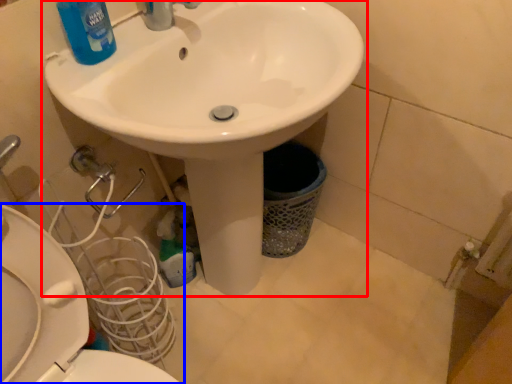
Question: Which point is closer to the camera, sink (highlighted by a red box) or toilet (highlighted by a blue box)?

Choices:
 (A) sink
 (B) toilet

Answer: (A)